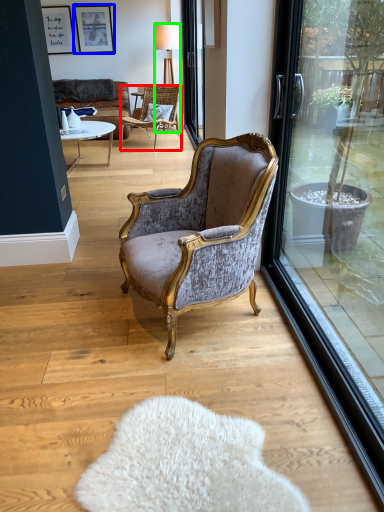
Question: Based on their relative distances, which object is nearer to chair (highlighted by a red box)? Choose from picture frame (highlighted by a blue box) and lamp (highlighted by a green box).

Choices:
 (A) picture frame
 (B) lamp

Answer: (B)